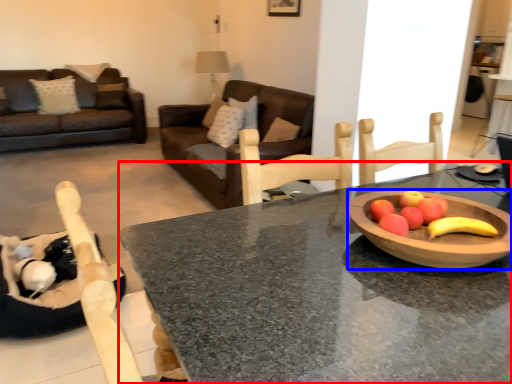
Question: Which object is further to the camera taking this photo, desk (highlighted by a red box) or bowl (highlighted by a blue box)?

Choices:
 (A) desk
 (B) bowl

Answer: (B)